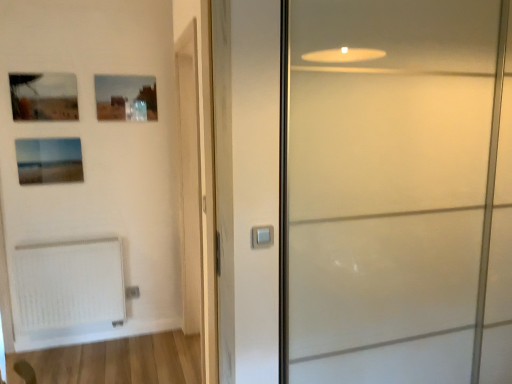
Question: In the image, is wooden barn door at center on the left side or the right side of satin silver switch at center?

Choices:
 (A) right
 (B) left

Answer: (B)

Question: From the image's perspective, is wooden barn door at center positioned above or below satin silver switch at center?

Choices:
 (A) below
 (B) above

Answer: (B)

Question: Based on their relative distances, which object is farther from the matte glass picture frame at upper left, which appears as the 1th picture frame when ordered from the bottom?

Choices:
 (A) white textured radiator at lower left
 (B) wooden barn door at center
 (C) satin silver switch at center
 (D) matte glass picture frame at upper center, which is the third picture frame from bottom to top
 (E) matte glass picture frame at upper left, the second picture frame from the bottom

Answer: (C)

Question: Estimate the real-world distances between objects in this image. Which object is closer to the satin silver switch at center?

Choices:
 (A) wooden barn door at center
 (B) matte glass picture frame at upper left, the second picture frame in the top-to-bottom sequence
 (C) matte glass picture frame at upper left, which appears as the 1th picture frame when ordered from the bottom
 (D) frosted glass door at right
 (E) white textured radiator at lower left

Answer: (D)